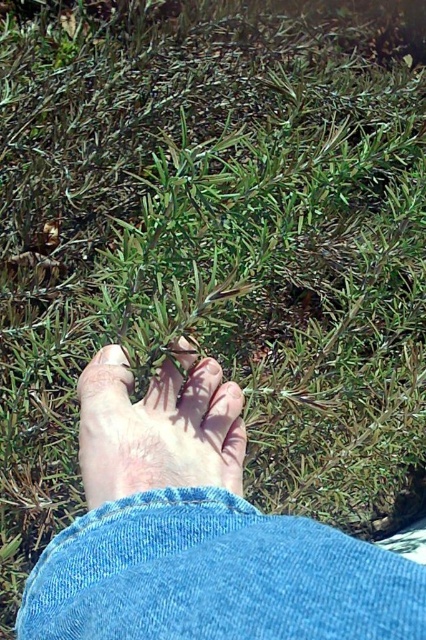
You are a photographer capturing the scene of a foot touching a plant. You notice two feet in the image, a smooth skin foot at center and a pale skin foot at center. Which foot is positioned lower in the image?

The smooth skin foot at center is positioned lower than the pale skin foot at center in the image.

You are a physical therapist evaluating a patient who has a smooth skin foot at center and a pale skin foot at center. The patient wants to know if they can place both feet side by side on a 2.5 inch wide yoga mat without overlapping. Can they?

The smooth skin foot at center and pale skin foot at center are 1.65 inches apart from each other. Since the yoga mat is 2.5 inches wide, there is enough space to place both feet side by side without overlapping as the combined width of the feet plus the gap between them is less than the mat width. However, the exact placement depends on the individual foot sizes, which aren